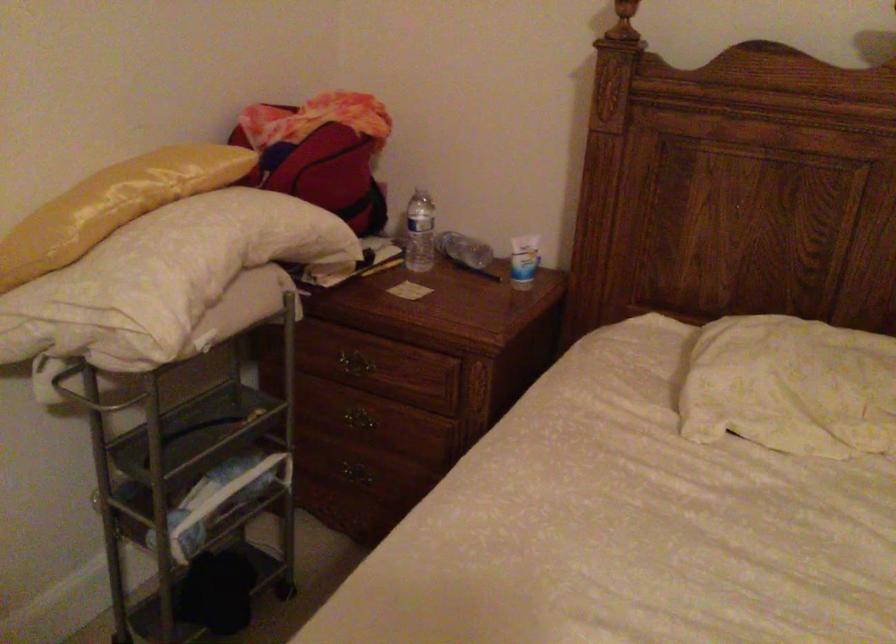
Find the location of a particular element. This screenshot has height=644, width=896. yellow pillow is located at coordinates (113, 205).